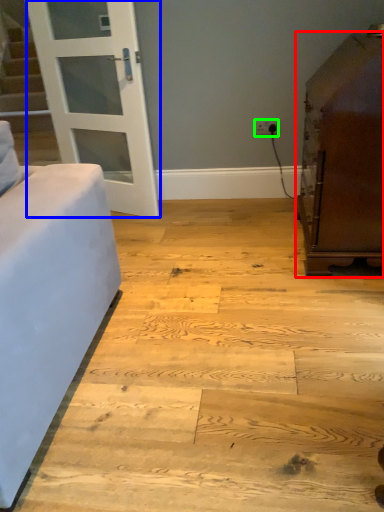
Question: Which is nearer to the furniture (highlighted by a red box)? door (highlighted by a blue box) or electric outlet (highlighted by a green box).

Choices:
 (A) door
 (B) electric outlet

Answer: (B)